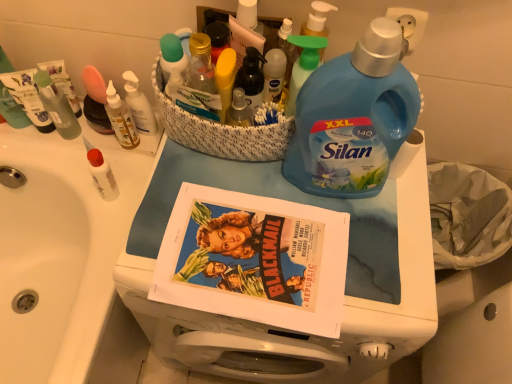
Find the location of `vacant space in front of blue plastic bottle at upper right, placed as the second bottle when sorted from left to right`. vacant space in front of blue plastic bottle at upper right, placed as the second bottle when sorted from left to right is located at coordinates (355, 262).